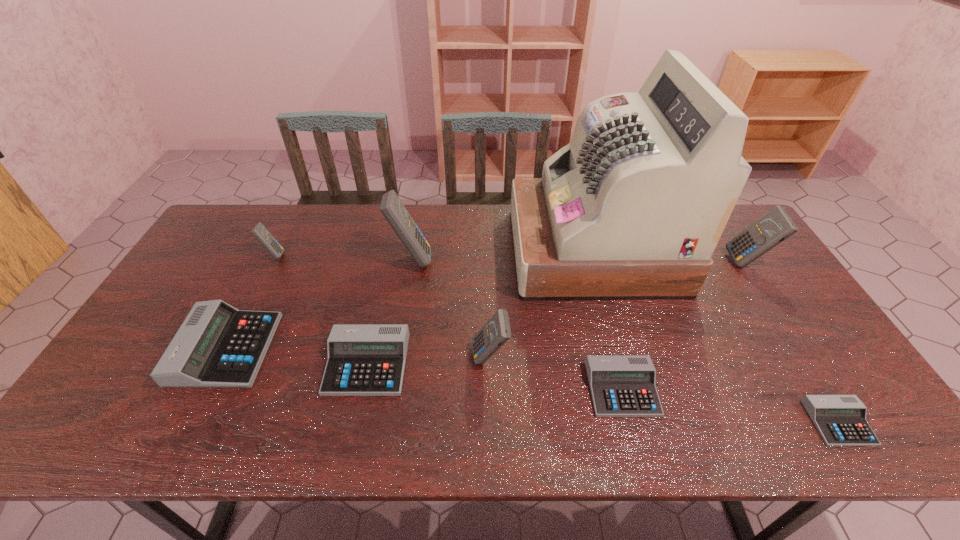
Identify the location of vacant space in between the fourth shortest calculator and the second shortest object. The width and height of the screenshot is (960, 540). (424, 369).

Where is `vacant area between the fifth tallest object and the tallest object`? The height and width of the screenshot is (540, 960). vacant area between the fifth tallest object and the tallest object is located at coordinates (434, 253).

Identify the location of free space between the shortest object and the third tallest calculator. (664, 390).

Where is `empty space that is in between the cash register and the second gray calculator from left to right`? empty space that is in between the cash register and the second gray calculator from left to right is located at coordinates (481, 307).

Where is `free spot between the tallest calculator and the fourth shortest calculator`? The image size is (960, 540). free spot between the tallest calculator and the fourth shortest calculator is located at coordinates (319, 303).

Where is `free space between the second tallest calculator and the second gray calculator from left to right`? The image size is (960, 540). free space between the second tallest calculator and the second gray calculator from left to right is located at coordinates (557, 313).

In order to click on vacant area that lies between the third smallest gray calculator and the sixth tallest object in this screenshot , I will do `click(297, 356)`.

Locate an element on the screen. Image resolution: width=960 pixels, height=540 pixels. unoccupied area between the cash register and the smallest gray calculator is located at coordinates (716, 337).

At what (x,y) coordinates should I click in order to perform the action: click on vacant space that is in between the second tallest calculator and the leftmost gray calculator. Please return your answer as a coordinate pair (x, y). The width and height of the screenshot is (960, 540). Looking at the image, I should click on (487, 305).

Identify which object is the closest to the fifth tallest calculator. Please provide its 2D coordinates. Your answer should be formatted as a tuple, i.e. [(x, y)], where the tuple contains the x and y coordinates of a point satisfying the conditions above.

[(363, 359)]